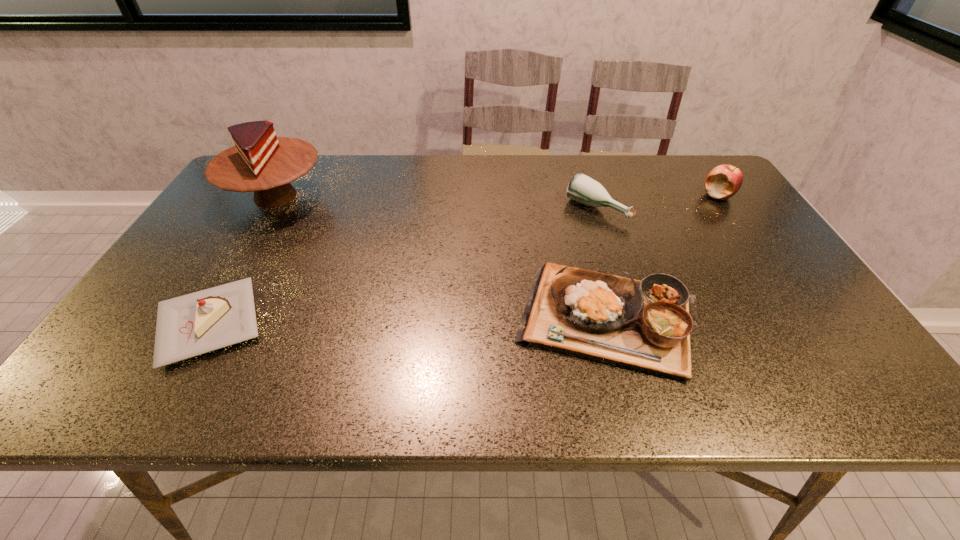
Image resolution: width=960 pixels, height=540 pixels. I want to click on object at the near left corner, so click(x=190, y=325).

You are a GUI agent. You are given a task and a screenshot of the screen. Output one action in this format:
    pyautogui.click(x=<x>, y=<y>)
    Task: Click on the object located at the far right corner
    Image resolution: width=960 pixels, height=540 pixels.
    Given the screenshot: What is the action you would take?
    click(724, 181)

You are a GUI agent. You are given a task and a screenshot of the screen. Output one action in this format:
    pyautogui.click(x=<x>, y=<y>)
    Task: Click on the free region at the far edge of the desktop
    
    Given the screenshot: What is the action you would take?
    pyautogui.click(x=608, y=182)

In the image, there is a desktop. Identify the location of free space at the near edge. The image size is (960, 540). (332, 387).

Find the location of `free space at the right edge of the desktop`. free space at the right edge of the desktop is located at coordinates (786, 305).

Identify the location of unoccupied area between the taller cake and the bottle. (436, 202).

Identify the location of vacant area between the shortest object and the bottle. Image resolution: width=960 pixels, height=540 pixels. (403, 266).

Locate an element on the screen. vacant space that is in between the platter and the rightmost object is located at coordinates tap(664, 257).

The width and height of the screenshot is (960, 540). I want to click on free spot between the apple and the bottle, so click(658, 202).

Locate an element on the screen. vacant region between the shortest object and the farther cake is located at coordinates [x=242, y=260].